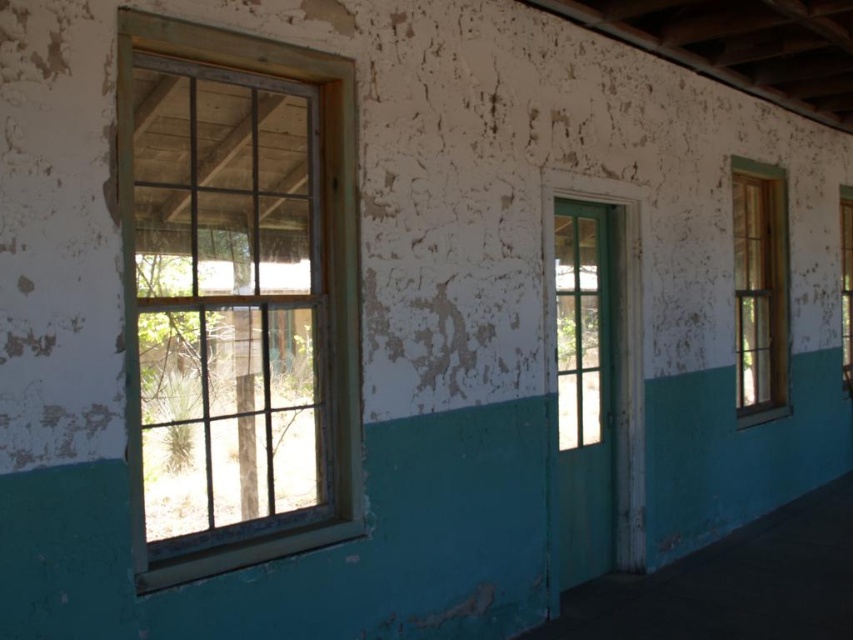
Question: Which of these objects is positioned farthest from the green matte glass door at center?

Choices:
 (A) clear glass window at right
 (B) wooden frame window at right

Answer: (A)

Question: Does wooden frame window at right have a greater width compared to green matte glass door at center?

Choices:
 (A) yes
 (B) no

Answer: (A)

Question: Is wooden frame window at right further to camera compared to green matte glass door at center?

Choices:
 (A) no
 (B) yes

Answer: (B)

Question: Can you confirm if green matte glass door at center is thinner than clear glass window at right?

Choices:
 (A) no
 (B) yes

Answer: (A)

Question: Among these objects, which one is nearest to the camera?

Choices:
 (A) wooden-framed window at center-left
 (B) green matte glass door at center
 (C) clear glass window at right
 (D) wooden frame window at right

Answer: (A)

Question: Which point is closer to the camera taking this photo?

Choices:
 (A) (607, 356)
 (B) (160, 492)
 (C) (740, 285)

Answer: (B)